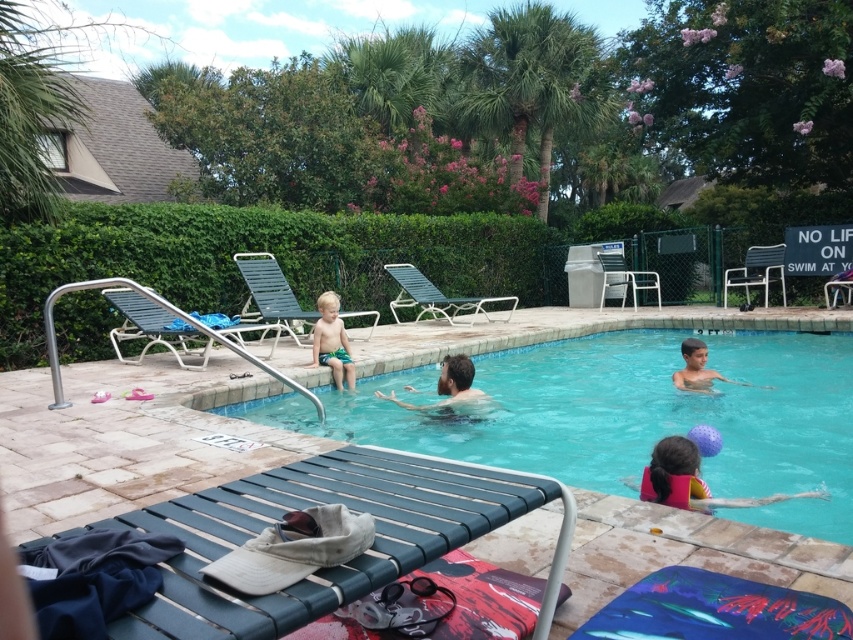
Who is positioned more to the left, clear blue water at center or pink life vest at lower right?

clear blue water at center

Which is above, clear blue water at center or pink life vest at lower right?

Positioned higher is clear blue water at center.

The height and width of the screenshot is (640, 853). I want to click on clear blue water at center, so click(x=625, y=417).

Who is lower down, green fabric shorts at center or smooth skin man at center?

smooth skin man at center is lower down.

Is green fabric shorts at center to the left of smooth skin man at center from the viewer's perspective?

Yes, green fabric shorts at center is to the left of smooth skin man at center.

Between point (320, 300) and point (447, 380), which one is positioned in front?

Point (447, 380)

You are a GUI agent. You are given a task and a screenshot of the screen. Output one action in this format:
    pyautogui.click(x=<x>, y=<y>)
    Task: Click on the green fabric shorts at center
    The width and height of the screenshot is (853, 640).
    Given the screenshot: What is the action you would take?
    pyautogui.click(x=332, y=340)

Based on the photo, does green fabric shorts at center have a lesser width compared to smooth skin boy at center?

Indeed, green fabric shorts at center has a lesser width compared to smooth skin boy at center.

Is green fabric shorts at center taller than smooth skin boy at center?

Yes, green fabric shorts at center is taller than smooth skin boy at center.

Describe the element at coordinates (332, 340) in the screenshot. I see `green fabric shorts at center` at that location.

Locate an element on the screen. The width and height of the screenshot is (853, 640). green fabric shorts at center is located at coordinates (332, 340).